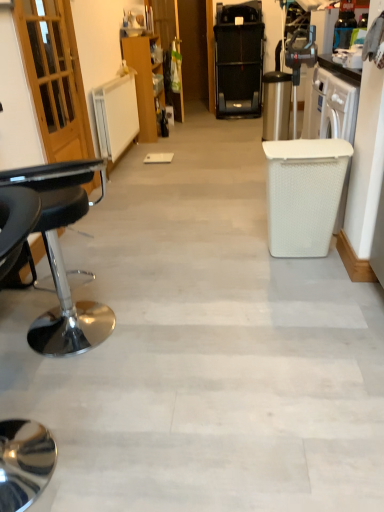
Question: Is the depth of black leather stool at left less than that of black plastic treadmill at upper center?

Choices:
 (A) yes
 (B) no

Answer: (A)

Question: Is there a large distance between black leather stool at left and black plastic treadmill at upper center?

Choices:
 (A) no
 (B) yes

Answer: (B)

Question: Is black leather stool at left smaller than black plastic treadmill at upper center?

Choices:
 (A) no
 (B) yes

Answer: (B)

Question: From the image's perspective, is black leather stool at left over black plastic treadmill at upper center?

Choices:
 (A) yes
 (B) no

Answer: (B)

Question: Can black plastic treadmill at upper center be found inside black leather stool at left?

Choices:
 (A) no
 (B) yes

Answer: (A)

Question: From a real-world perspective, is wooden cabinet at center physically located above or below black leather stool at left?

Choices:
 (A) above
 (B) below

Answer: (A)

Question: Is wooden cabinet at center bigger or smaller than black leather stool at left?

Choices:
 (A) big
 (B) small

Answer: (A)

Question: From the image's perspective, is wooden cabinet at center positioned above or below black leather stool at left?

Choices:
 (A) below
 (B) above

Answer: (B)

Question: Looking at their shapes, would you say wooden cabinet at center is wider or thinner than black leather stool at left?

Choices:
 (A) thin
 (B) wide

Answer: (A)

Question: Relative to black leather stool at left, is black plastic treadmill at upper center in front or behind?

Choices:
 (A) front
 (B) behind

Answer: (B)

Question: Considering the positions of black plastic treadmill at upper center and black leather stool at left in the image, is black plastic treadmill at upper center taller or shorter than black leather stool at left?

Choices:
 (A) short
 (B) tall

Answer: (B)

Question: From a real-world perspective, is black plastic treadmill at upper center physically located above or below black leather stool at left?

Choices:
 (A) below
 (B) above

Answer: (B)

Question: Is point (225, 53) positioned closer to the camera than point (33, 177)?

Choices:
 (A) farther
 (B) closer

Answer: (A)

Question: From a real-world perspective, is wooden cabinet at center physically located above or below black plastic treadmill at upper center?

Choices:
 (A) above
 (B) below

Answer: (B)

Question: Is wooden cabinet at center spatially inside black plastic treadmill at upper center, or outside of it?

Choices:
 (A) outside
 (B) inside

Answer: (A)